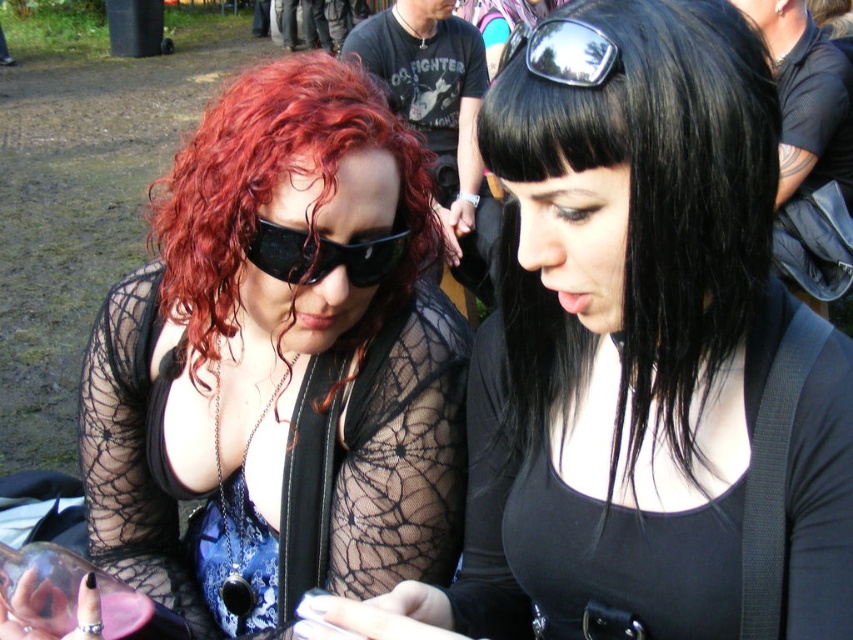
Does black matte sunglasses at center have a lesser width compared to metallic reflective sunglasses at upper center?

Incorrect, black matte sunglasses at center's width is not less than metallic reflective sunglasses at upper center's.

Does point (368, 280) come behind point (587, 42)?

Yes, it is.

Is point (260, 253) farther from camera compared to point (544, 52)?

Yes.

This screenshot has height=640, width=853. What are the coordinates of `black matte sunglasses at center` in the screenshot? It's located at pos(321,253).

Does black shiny hair at center appear on the right side of curly red hair at left?

Correct, you'll find black shiny hair at center to the right of curly red hair at left.

Which of these two, black shiny hair at center or curly red hair at left, stands shorter?

Standing shorter between the two is curly red hair at left.

Is point (686, 401) behind point (320, 352)?

That is False.

Where is `black shiny hair at center`? This screenshot has width=853, height=640. black shiny hair at center is located at coordinates (636, 225).

Does curly red hair at left appear on the right side of black matte sunglasses at center?

In fact, curly red hair at left is to the left of black matte sunglasses at center.

Between curly red hair at left and black matte sunglasses at center, which one is positioned lower?

black matte sunglasses at center

Is point (369, 307) behind point (396, 253)?

Yes, it is.

In order to click on curly red hair at left in this screenshot , I will do `click(276, 193)`.